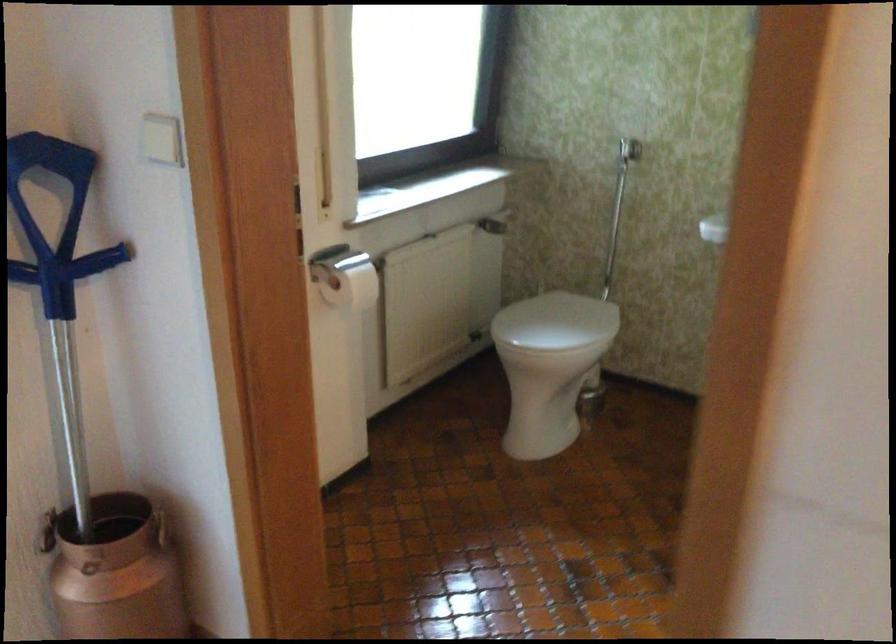
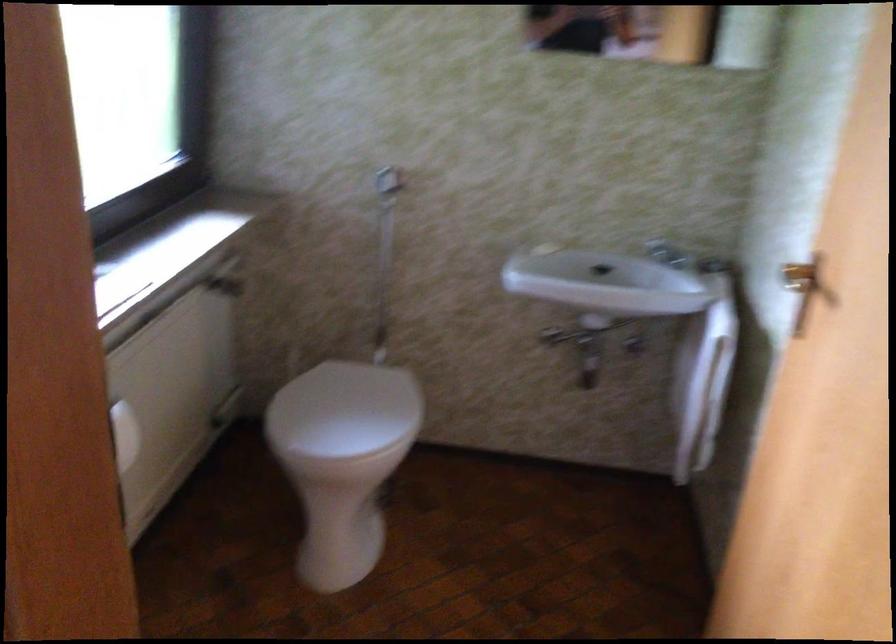
Question: The camera is either moving clockwise (left) or counter-clockwise (right) around the object. The first image is from the beginning of the video and the second image is from the end. Is the camera moving left or right when shooting the video?

Choices:
 (A) Left
 (B) Right

Answer: (A)